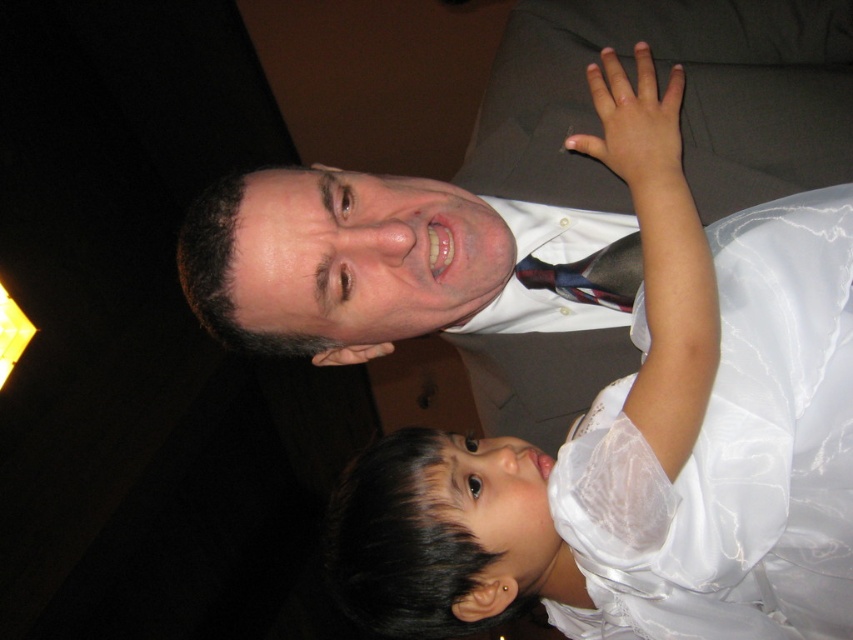
Question: Is white satin dress at center to the left of multicolored woven tie at center from the viewer's perspective?

Choices:
 (A) yes
 (B) no

Answer: (B)

Question: Which point appears closest to the camera in this image?

Choices:
 (A) (599, 292)
 (B) (730, 298)

Answer: (B)

Question: In this image, where is white satin dress at center located relative to white satin dress at upper right?

Choices:
 (A) left
 (B) right

Answer: (A)

Question: Which of the following is the farthest from the observer?

Choices:
 (A) (633, 298)
 (B) (764, 358)

Answer: (A)

Question: Which object is the closest to the multicolored woven tie at center?

Choices:
 (A) white satin dress at upper right
 (B) white satin dress at center

Answer: (B)

Question: Considering the relative positions of white satin dress at center and white satin dress at upper right in the image provided, where is white satin dress at center located with respect to white satin dress at upper right?

Choices:
 (A) right
 (B) left

Answer: (B)